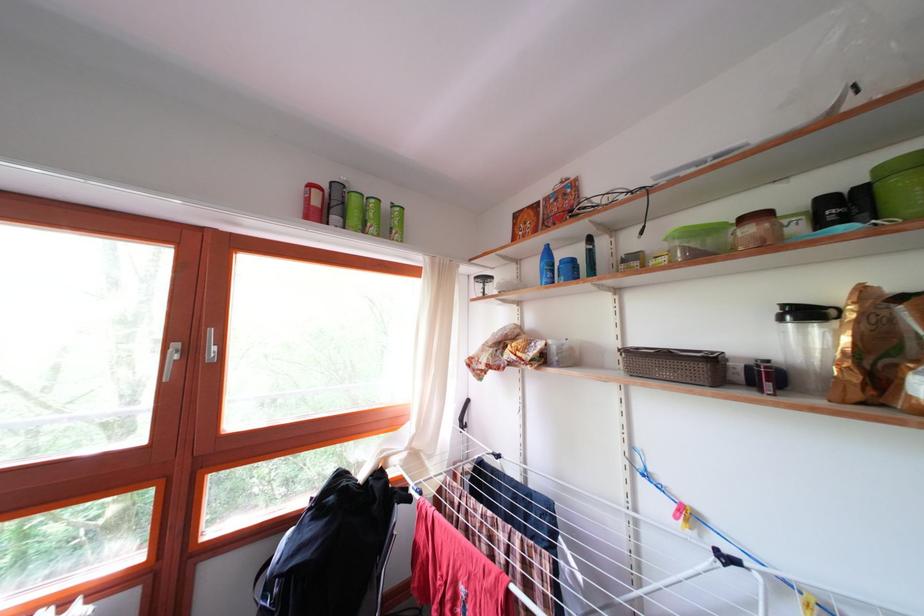
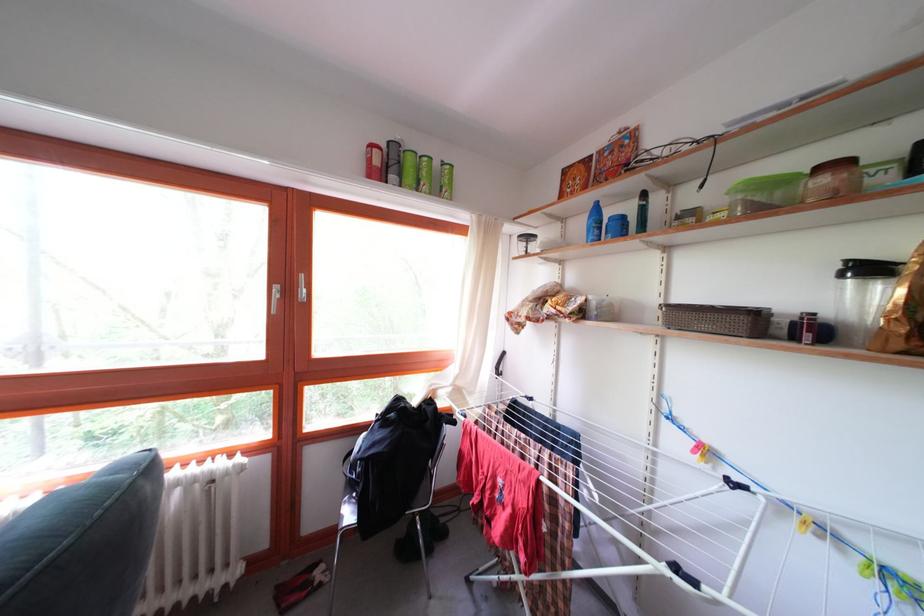
Find the pixel in the second image that matches (x=320, y=192) in the first image.

(381, 152)